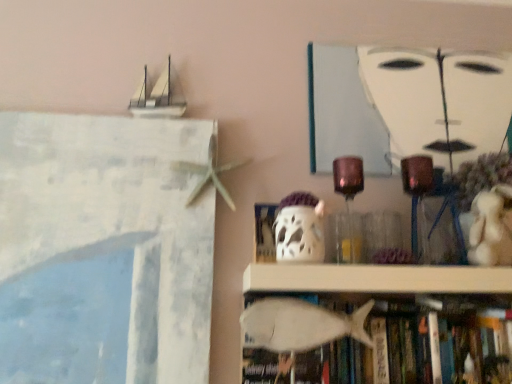
Question: From a real-world perspective, relative to white matte fish at lower center, is white matte ghost at center vertically above or below?

Choices:
 (A) above
 (B) below

Answer: (A)

Question: Is white matte ghost at center spatially inside white matte fish at lower center, or outside of it?

Choices:
 (A) outside
 (B) inside

Answer: (A)

Question: Considering the real-world distances, which object is farthest from the white matte fish at lower center?

Choices:
 (A) white matte fish at lower center
 (B) white plush bear at right
 (C) white matte painting at upper center
 (D) white matte ghost at center
 (E) white matte fish at lower center

Answer: (C)

Question: Estimate the real-world distances between objects in this image. Which object is closer to the white matte ghost at center?

Choices:
 (A) white matte painting at upper center
 (B) white plush bear at right
 (C) white matte fish at lower center
 (D) white matte fish at lower center
 (E) white matte fish at lower center

Answer: (D)